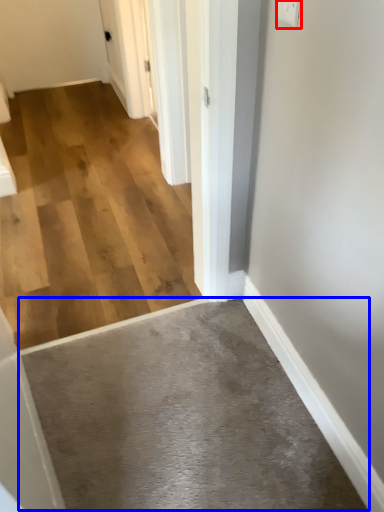
Question: Among these objects, which one is nearest to the camera, electric outlet (highlighted by a red box) or concrete (highlighted by a blue box)?

Choices:
 (A) electric outlet
 (B) concrete

Answer: (A)